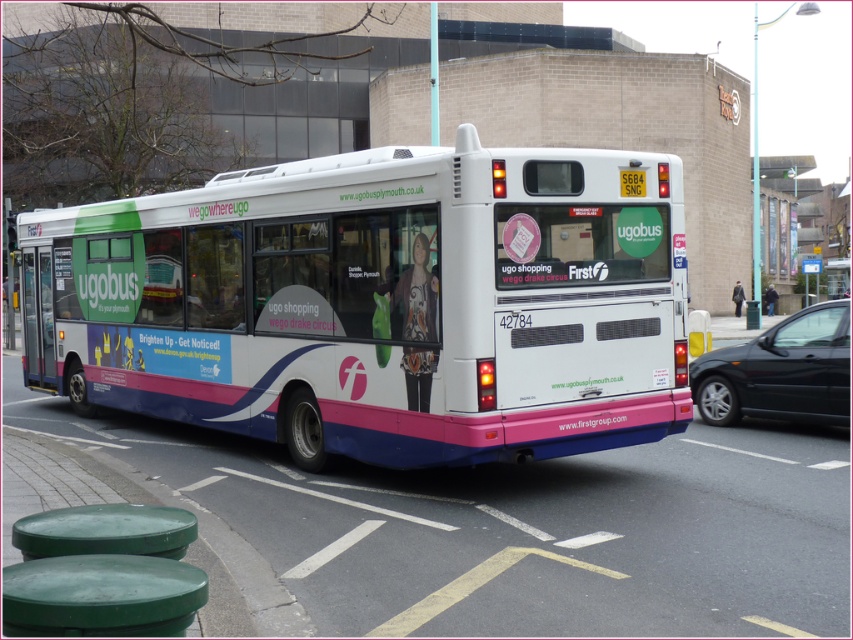
Question: Which of the following is the closest to the observer?

Choices:
 (A) black glossy car at right
 (B) yellow plastic license plate at rear center

Answer: (B)

Question: Estimate the real-world distances between objects in this image. Which object is closer to the black glossy car at right?

Choices:
 (A) yellow plastic license plate at rear center
 (B) white matte bus at center

Answer: (A)

Question: Is white matte bus at center thinner than black glossy car at right?

Choices:
 (A) yes
 (B) no

Answer: (B)

Question: Which object is closer to the camera taking this photo?

Choices:
 (A) black glossy car at right
 (B) yellow plastic license plate at rear center
 (C) white matte bus at center

Answer: (C)

Question: Can you confirm if white matte bus at center is positioned to the right of yellow plastic license plate at rear center?

Choices:
 (A) no
 (B) yes

Answer: (A)

Question: Is white matte bus at center below yellow plastic license plate at rear center?

Choices:
 (A) yes
 (B) no

Answer: (A)